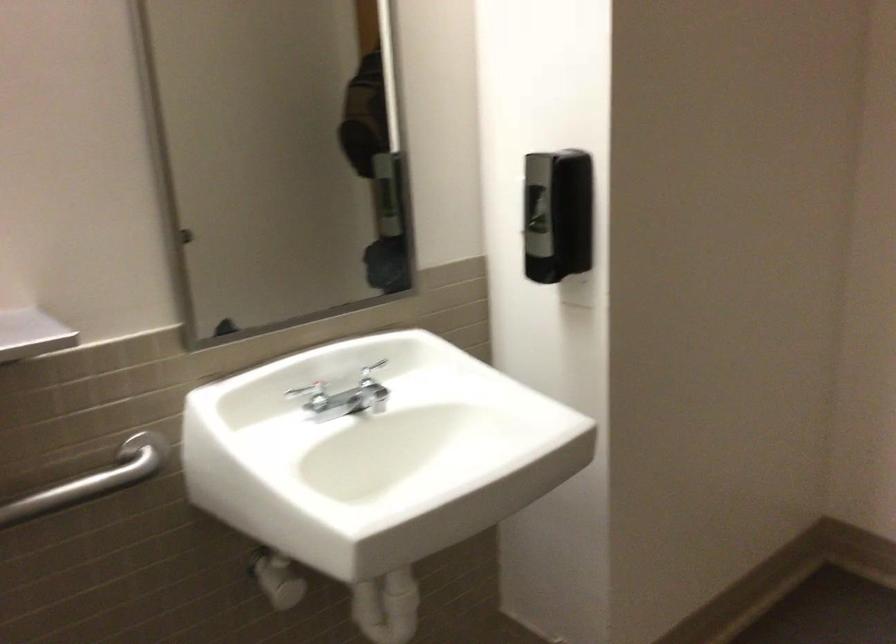
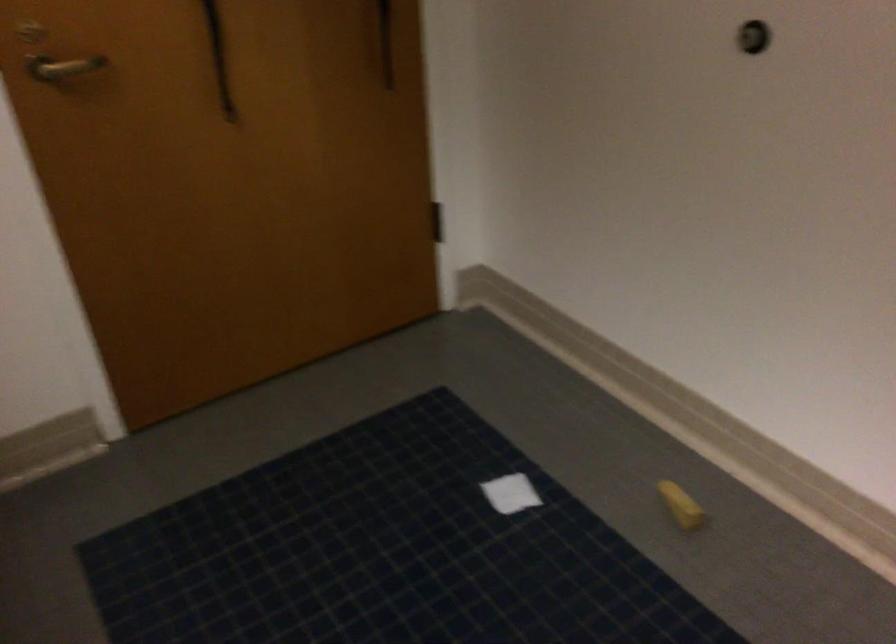
First-person continuous shooting, in which direction is the camera rotating?

The rotation direction of the camera is right-down.